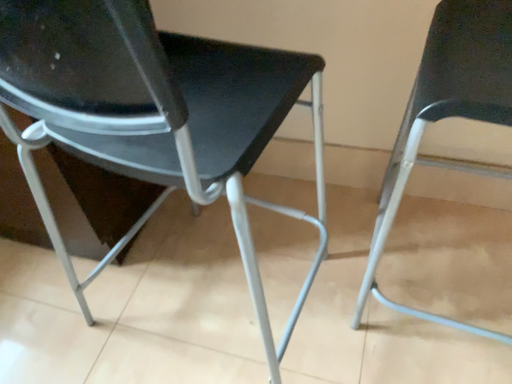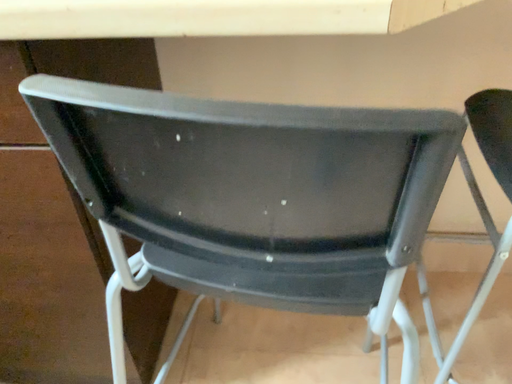
Question: How did the camera likely rotate when shooting the video?

Choices:
 (A) rotated upward
 (B) rotated downward

Answer: (A)